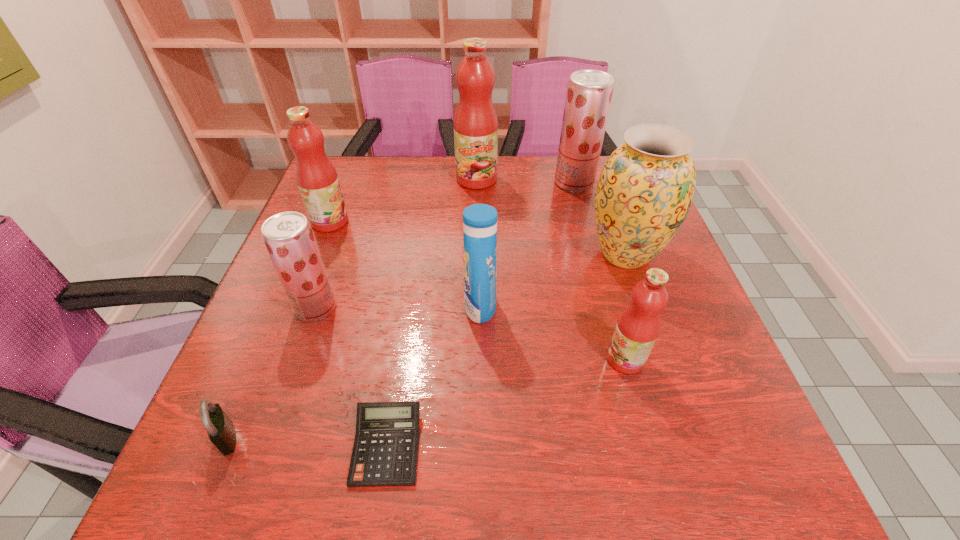
This screenshot has height=540, width=960. I want to click on the farthest pink fruit juice, so click(475, 123).

Identify the location of the tallest fruit juice. The height and width of the screenshot is (540, 960). (475, 123).

The width and height of the screenshot is (960, 540). I want to click on the bigger strawberry fruit juice, so click(x=589, y=92).

Locate an element on the screen. The image size is (960, 540). the right strawberry fruit juice is located at coordinates (589, 92).

What are the coordinates of `the second farthest pink fruit juice` in the screenshot? It's located at (316, 177).

I want to click on the second biggest pink fruit juice, so click(316, 177).

Find the location of `yellow vase`. yellow vase is located at coordinates (646, 188).

Locate an element on the screen. detergent is located at coordinates (479, 220).

The height and width of the screenshot is (540, 960). I want to click on the second nearest fruit juice, so click(x=288, y=236).

In order to click on the nearer strawberry fruit juice in this screenshot , I will do `click(288, 236)`.